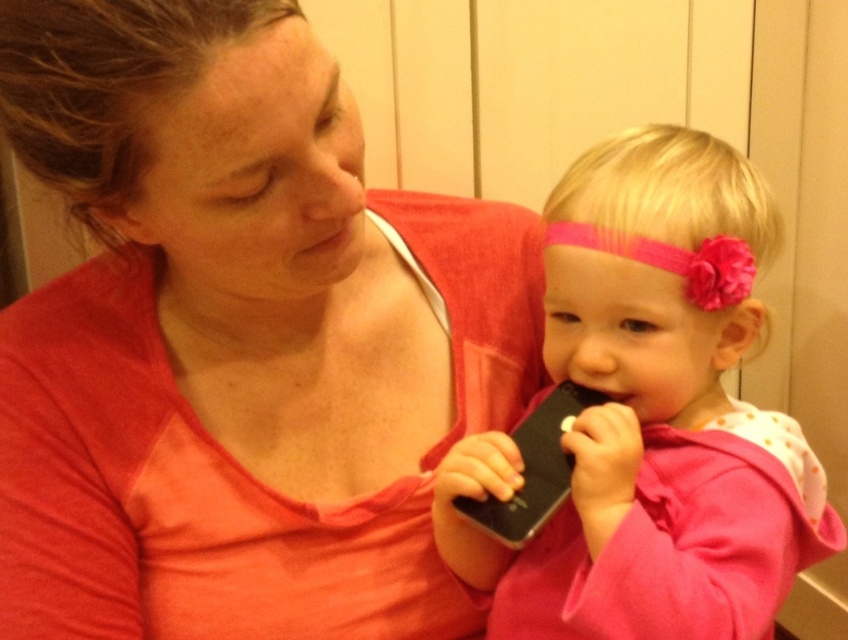
You are a photographer trying to capture a closeup of the child chewing on the smartphone. The camera you are using has a focus point at coordinate point (237, 339). According to the scene, what object will be in focus?

The point (237, 339) is on the matte pink shirt at center, so the focus will be on the matte pink shirt at center.

You are a photographer standing in front of the scene described. You want to capture a closeup of the matte pink shirt at center without including any other objects in the frame. Based on the distance provided, what is the minimum focal length you should use if your camera has a sensor size of 36mm x 24mm and you want to avoid distortion?

The matte pink shirt at center is 16.07 inches away from the viewer. To capture a closeup without distortion using a 36mm x 24mm sensor, the minimum focal length required would be approximately 50mm. This ensures that the subject fills the frame while maintaining natural proportions.